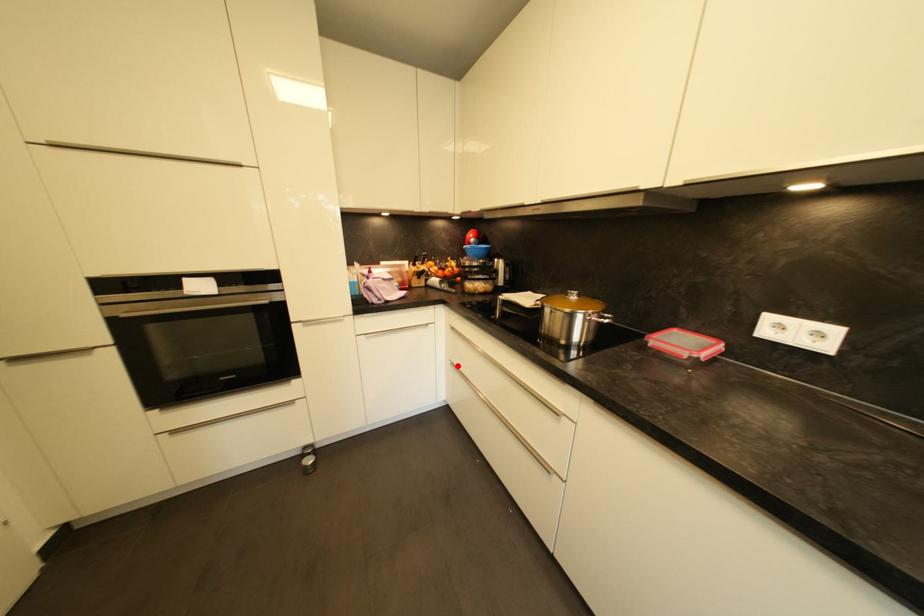
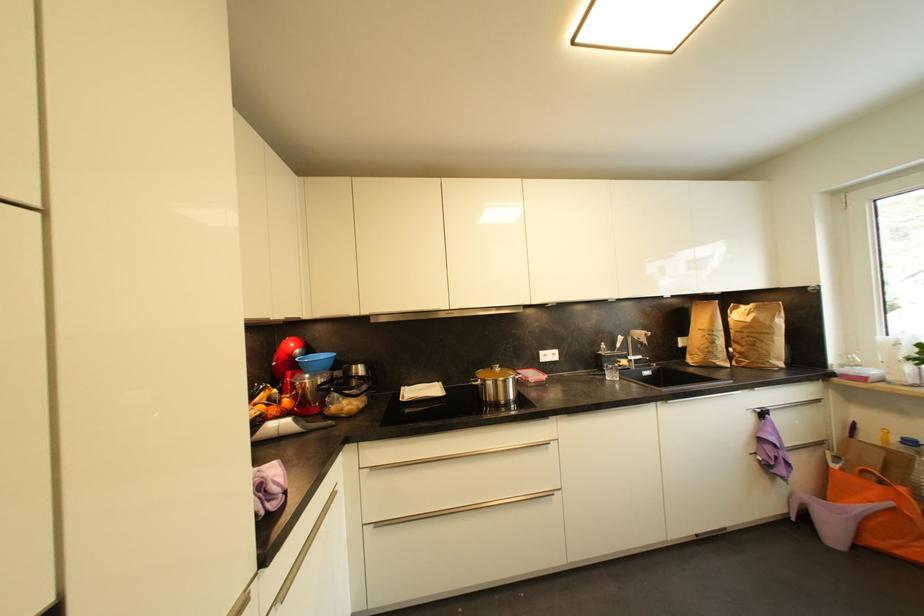
In the second image, find the point that corresponds to the highlighted location in the first image.

(382, 527)